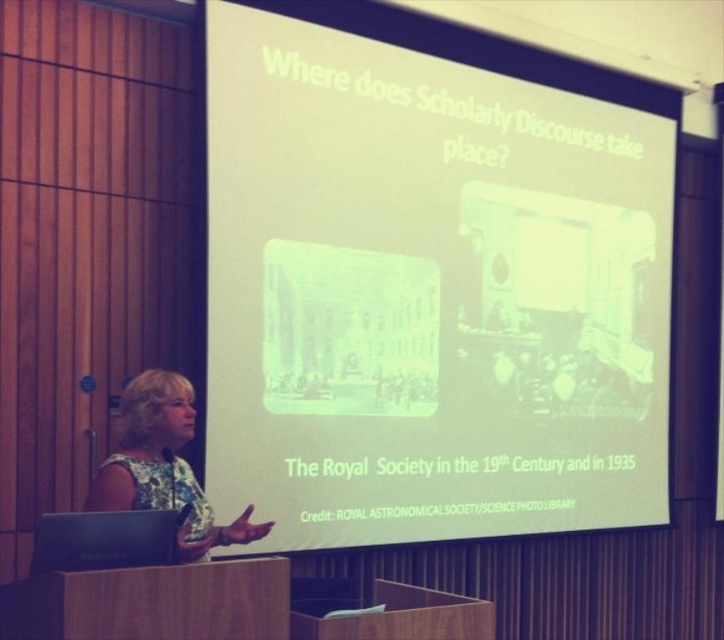
Question: Which of the following is the farthest from the observer?

Choices:
 (A) white matte projection screen at upper center
 (B) floral fabric dress at lower left

Answer: (A)

Question: Which point is closer to the camera taking this photo?

Choices:
 (A) (188, 412)
 (B) (369, 76)

Answer: (A)

Question: Is the position of white matte projection screen at upper center more distant than that of floral fabric dress at lower left?

Choices:
 (A) no
 (B) yes

Answer: (B)

Question: Can you confirm if white matte projection screen at upper center is thinner than floral fabric dress at lower left?

Choices:
 (A) no
 (B) yes

Answer: (A)

Question: Can you confirm if white matte projection screen at upper center is wider than floral fabric dress at lower left?

Choices:
 (A) yes
 (B) no

Answer: (A)

Question: Which of the following is the closest to the observer?

Choices:
 (A) white matte projection screen at upper center
 (B) floral fabric dress at lower left

Answer: (B)